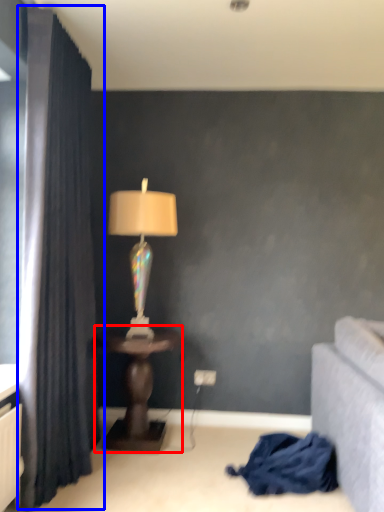
Question: Which object is closer to the camera taking this photo, table (highlighted by a red box) or curtain (highlighted by a blue box)?

Choices:
 (A) table
 (B) curtain

Answer: (B)